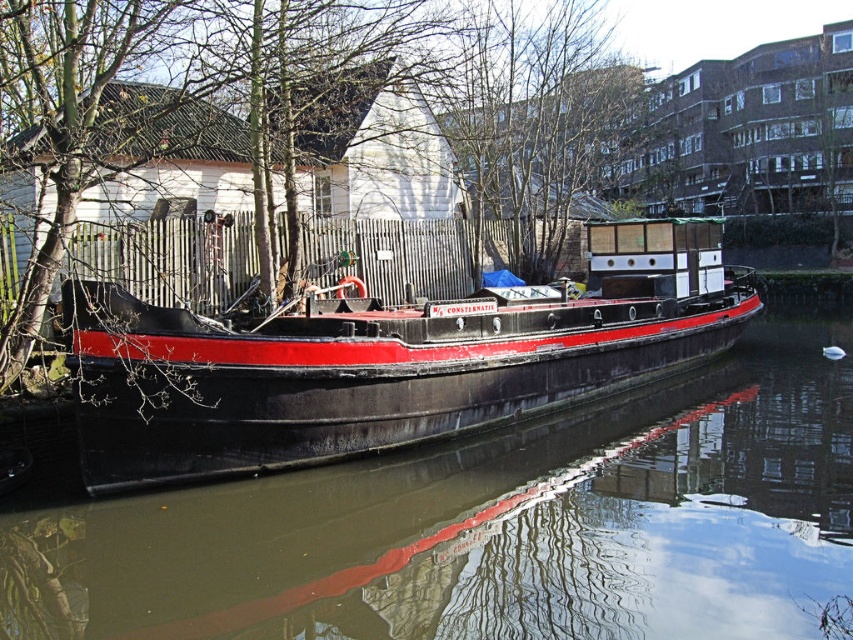
You are a photographer trying to capture the boat named CONSTANTINE. You notice two similar boats at the center of the scene. Which boat is closer to you, the black rubber boat at center or the black matte boat at center?

The black rubber boat at center is closer to you since it is positioned in front of the black matte boat at center.

You are a maintenance worker on the canal. You need to inspect both the black rubber boat at center and the black matte boat at center. Which boat should you check first if you want to start with the one that is located below the other?

The black rubber boat at center is positioned under the black matte boat at center, so you should check the black rubber boat at center first since it is located below.